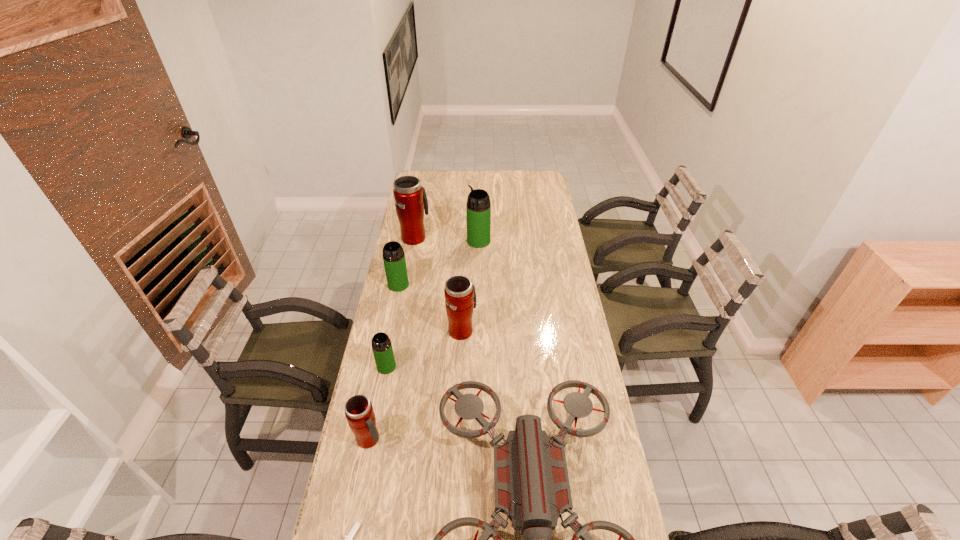
This screenshot has width=960, height=540. I want to click on free space that satisfies the following two spatial constraints: 1. from the spout of the farthest green thermos bottle; 2. from the spout of the second biggest green thermos bottle, so click(x=478, y=285).